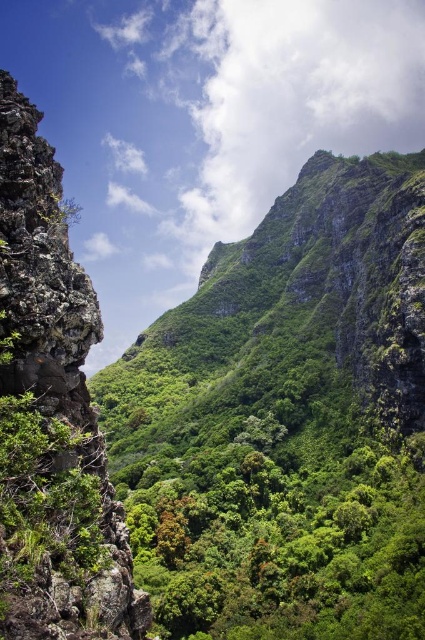
You are standing in the valley and want to place a small garden at the exact center of the valley. Considering the rough textured rock at left, where should you place the garden to ensure it is not near the rock?

The rough textured rock at left is located at point (56,369), so to place the garden at the exact center of the valley, you should position it away from that coordinate to avoid proximity to the rock.

You are a hiker who wants to take a photo of the green leafy tree at center. To get the best shot, you need to stand to the right of the rough textured rock at left. Based on the scene, can you position yourself there?

The rough textured rock at left is positioned on the left side of green leafy tree at center, so standing to the right of the rough textured rock at left would place you in an ideal position to capture the green leafy tree at center without obstruction.

You are a hiker planning to cross the valley. You notice the rough textured rock at left and the green leafy tree at center. Which object would be more challenging to climb, considering their size?

The rough textured rock at left is bigger than the green leafy tree at center, so it would be more challenging to climb due to its larger size.